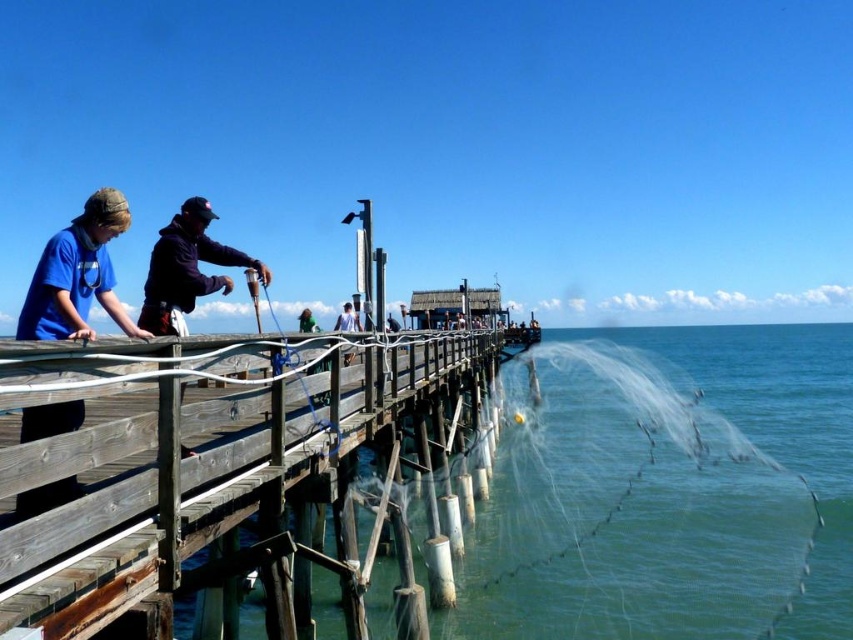
Question: Among these points, which one is farthest from the camera?

Choices:
 (A) (119, 202)
 (B) (190, 289)

Answer: (B)

Question: Can you confirm if weathered wood rail at center is positioned above dark blue hoodie at center?

Choices:
 (A) yes
 (B) no

Answer: (B)

Question: Which of the following is the farthest from the observer?

Choices:
 (A) blue matte shirt at left
 (B) light brown wooden pier at center

Answer: (B)

Question: Does transparent nylon fishing net at lower right lie behind dark blue hoodie at center?

Choices:
 (A) no
 (B) yes

Answer: (B)

Question: Is dark blue hoodie at center positioned before light brown wooden pier at center?

Choices:
 (A) yes
 (B) no

Answer: (A)

Question: Which is farther from the blue matte shirt at left?

Choices:
 (A) light brown wooden pier at center
 (B) weathered wood rail at center

Answer: (A)